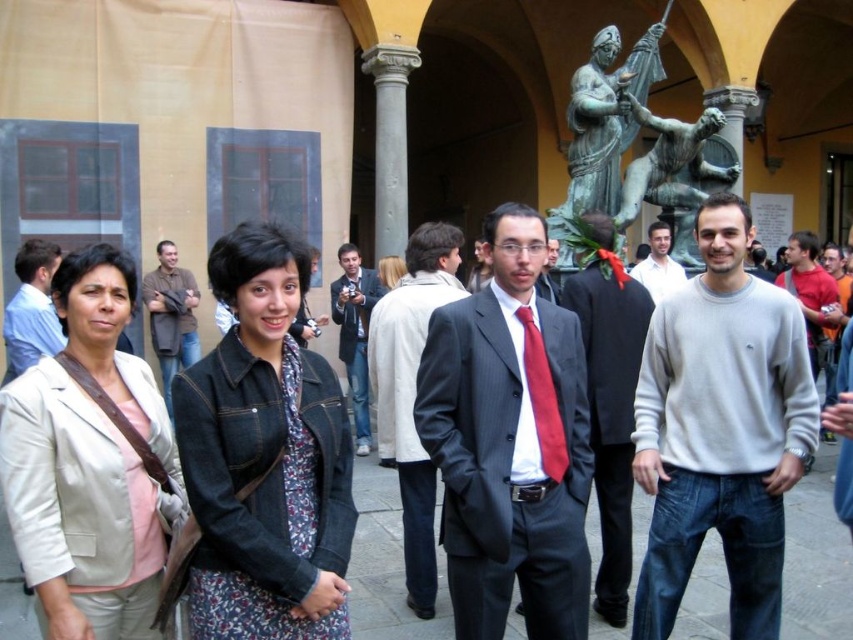
You are a photographer trying to capture a candid shot of the matte gray sweater at center and the blue denim jeans at center. Since you want to focus on the sweater, should you adjust your camera to focus on the foreground or background?

The matte gray sweater at center is in front of the blue denim jeans at center. To focus on the sweater, adjust your camera to focus on the foreground.

You are a photographer trying to capture a group photo of two people wearing the matte black suit at center and the gray sweater at center. The camera you are using has a maximum focus range of 15 meters. Will you be able to capture both subjects clearly in the same photo?

The matte black suit at center and gray sweater at center are 17.24 meters apart, which exceeds the camera maximum focus range of 15 meters. Therefore, you will not be able to capture both subjects clearly in the same photo.